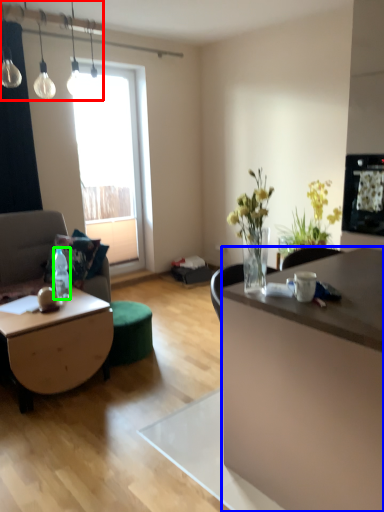
Question: Which is farther away from lamp (highlighted by a red box)? desk (highlighted by a blue box) or bottle (highlighted by a green box)?

Choices:
 (A) desk
 (B) bottle

Answer: (A)